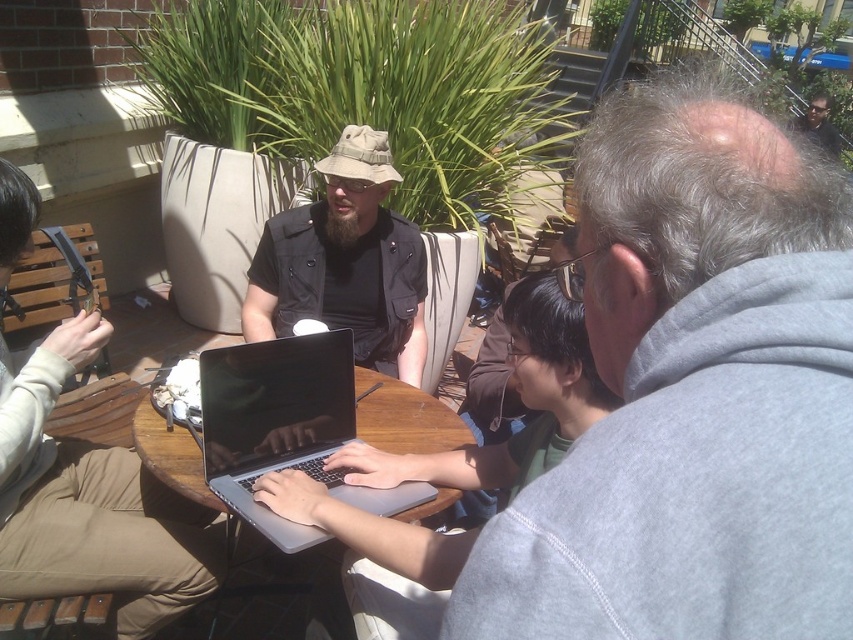
Question: Can you confirm if matte black vest at center is positioned to the right of silver metallic laptop at center?

Choices:
 (A) yes
 (B) no

Answer: (B)

Question: Which point is closer to the camera?

Choices:
 (A) (343, 209)
 (B) (811, 125)

Answer: (A)

Question: Does matte black vest at center have a larger size compared to silver metallic laptop at center?

Choices:
 (A) yes
 (B) no

Answer: (A)

Question: Does silver metallic laptop at center appear on the right side of shiny black sunglasses at upper right?

Choices:
 (A) yes
 (B) no

Answer: (B)

Question: Which point is farther to the camera?

Choices:
 (A) (225, 451)
 (B) (805, 118)

Answer: (B)

Question: Which point appears closest to the camera in this image?

Choices:
 (A) (267, 408)
 (B) (381, 209)

Answer: (A)